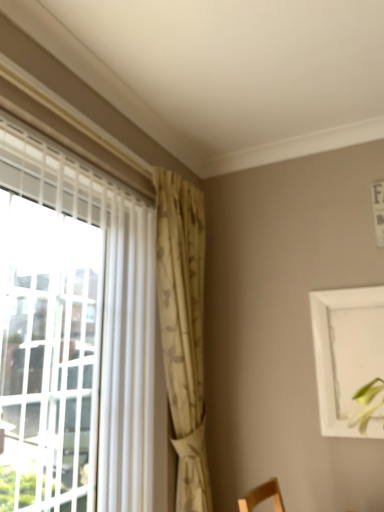
Where is `white matte picture frame at upper right`? The height and width of the screenshot is (512, 384). white matte picture frame at upper right is located at coordinates (349, 360).

This screenshot has width=384, height=512. Describe the element at coordinates (349, 360) in the screenshot. I see `white matte picture frame at upper right` at that location.

What do you see at coordinates (183, 329) in the screenshot? I see `beige textured curtain at center` at bounding box center [183, 329].

You are a GUI agent. You are given a task and a screenshot of the screen. Output one action in this format:
    pyautogui.click(x=<x>, y=<y>)
    Task: Click on the beige textured curtain at center
    
    Given the screenshot: What is the action you would take?
    pyautogui.click(x=183, y=329)

Where is `white matte picture frame at upper right`? This screenshot has height=512, width=384. white matte picture frame at upper right is located at coordinates (349, 360).

Based on the photo, does white matte picture frame at upper right appear on the right side of beige textured curtain at center?

Yes, white matte picture frame at upper right is to the right of beige textured curtain at center.

Which object is closer to the camera, white matte picture frame at upper right or beige textured curtain at center?

beige textured curtain at center.

Is point (352, 418) closer or farther from the camera than point (189, 404)?

Point (352, 418) is positioned closer to the camera compared to point (189, 404).

From the image's perspective, which is above, white matte picture frame at upper right or beige textured curtain at center?

beige textured curtain at center is shown above in the image.

From a real-world perspective, is white matte picture frame at upper right located beneath beige textured curtain at center?

Yes, from a real-world perspective, white matte picture frame at upper right is below beige textured curtain at center.

Which object is wider, white matte picture frame at upper right or beige textured curtain at center?

beige textured curtain at center.

Is white matte picture frame at upper right shorter than beige textured curtain at center?

Indeed, white matte picture frame at upper right has a lesser height compared to beige textured curtain at center.

Can you confirm if white matte picture frame at upper right is bigger than beige textured curtain at center?

Incorrect, white matte picture frame at upper right is not larger than beige textured curtain at center.

Looking at this image, is white matte picture frame at upper right situated inside beige textured curtain at center or outside?

white matte picture frame at upper right is not inside beige textured curtain at center, it's outside.

Does white matte picture frame at upper right touch beige textured curtain at center?

No, white matte picture frame at upper right is not in contact with beige textured curtain at center.

Is beige textured curtain at center at the back of white matte picture frame at upper right?

white matte picture frame at upper right does not have its back to beige textured curtain at center.

How different are the orientations of white matte picture frame at upper right and beige textured curtain at center in degrees?

They differ by 89.6 degrees in their facing directions.

Locate an element on the screen. picture frame below the beige textured curtain at center (from a real-world perspective) is located at coordinates (349, 360).

Would you say beige textured curtain at center is to the left or to the right of white matte picture frame at upper right in the picture?

In the image, beige textured curtain at center appears on the left side of white matte picture frame at upper right.

Relative to white matte picture frame at upper right, is beige textured curtain at center in front or behind?

Visually, beige textured curtain at center is located in front of white matte picture frame at upper right.

Does point (177, 222) lie in front of point (356, 320)?

No, (177, 222) is behind (356, 320).

From the image's perspective, is beige textured curtain at center located beneath white matte picture frame at upper right?

No, from the image's perspective, beige textured curtain at center is not below white matte picture frame at upper right.

From a real-world perspective, is beige textured curtain at center positioned above or below white matte picture frame at upper right?

beige textured curtain at center is situated higher than white matte picture frame at upper right in the real world.

Which object is wider, beige textured curtain at center or white matte picture frame at upper right?

beige textured curtain at center is wider.

Considering the relative sizes of beige textured curtain at center and white matte picture frame at upper right in the image provided, is beige textured curtain at center shorter than white matte picture frame at upper right?

Incorrect, the height of beige textured curtain at center does not fall short of that of white matte picture frame at upper right.

Can you confirm if beige textured curtain at center is bigger than white matte picture frame at upper right?

Yes.

Is white matte picture frame at upper right surrounded by beige textured curtain at center?

No, white matte picture frame at upper right is located outside of beige textured curtain at center.

Is the surface of beige textured curtain at center in direct contact with white matte picture frame at upper right?

beige textured curtain at center and white matte picture frame at upper right are clearly separated.

Is beige textured curtain at center oriented away from white matte picture frame at upper right?

That's not correct — beige textured curtain at center is not looking away from white matte picture frame at upper right.

How distant is beige textured curtain at center from white matte picture frame at upper right?

beige textured curtain at center is 65.88 centimeters from white matte picture frame at upper right.

The image size is (384, 512). What are the coordinates of `picture frame that is below the beige textured curtain at center (from the image's perspective)` in the screenshot? It's located at (349, 360).

Locate an element on the screen. picture frame behind the beige textured curtain at center is located at coordinates (349, 360).

Where is `curtain located on the left of white matte picture frame at upper right`? Image resolution: width=384 pixels, height=512 pixels. curtain located on the left of white matte picture frame at upper right is located at coordinates (183, 329).